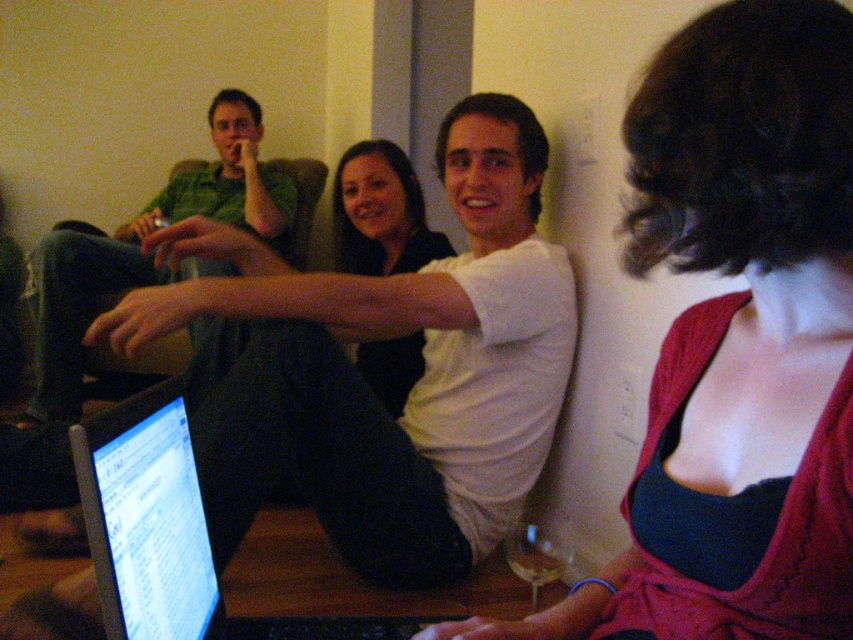
Looking at this image, you are standing in the room and want to locate the silver glossy laptop at center. According to the coordinates provided, where would you look?

The silver glossy laptop at center is located at point [171,534].

You are a photographer taking a picture of the matte red dress at center and the matte black shirt at center. Which one will appear larger in the photo?

The matte red dress at center will appear larger in the photo because it is closer to the viewer than the matte black shirt at center.